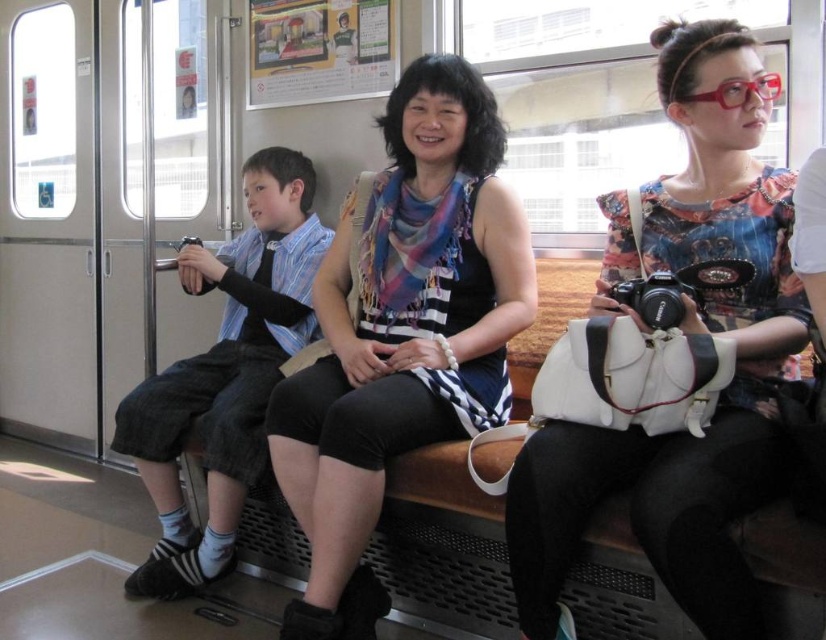
Is printed fabric shirt at center positioned in front of matte black scarf at center?

Yes.

Which of these two, printed fabric shirt at center or matte black scarf at center, stands taller?

With more height is matte black scarf at center.

Does point (559, 611) lie in front of point (388, 378)?

Yes, it is in front of point (388, 378).

Identify the location of printed fabric shirt at center. (691, 328).

Is matte black scarf at center positioned before denim shorts at left?

Yes, matte black scarf at center is closer to the viewer.

Is point (343, 298) positioned before point (259, 451)?

That is False.

You are a GUI agent. You are given a task and a screenshot of the screen. Output one action in this format:
    pyautogui.click(x=<x>, y=<y>)
    Task: Click on the matte black scarf at center
    The image size is (826, 640).
    Given the screenshot: What is the action you would take?
    pyautogui.click(x=402, y=333)

Can you confirm if printed fabric shirt at center is positioned below denim shorts at left?

No, printed fabric shirt at center is not below denim shorts at left.

I want to click on printed fabric shirt at center, so click(x=691, y=328).